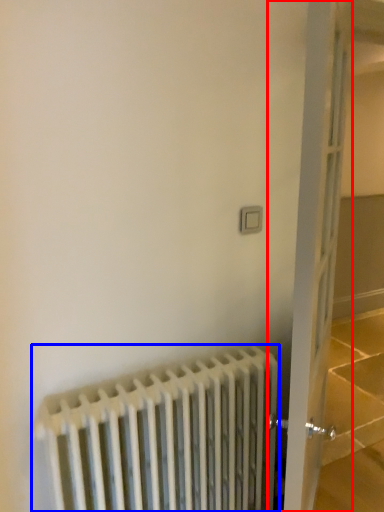
Question: Which object appears farthest to the camera in this image, door (highlighted by a red box) or radiator (highlighted by a blue box)?

Choices:
 (A) door
 (B) radiator

Answer: (B)